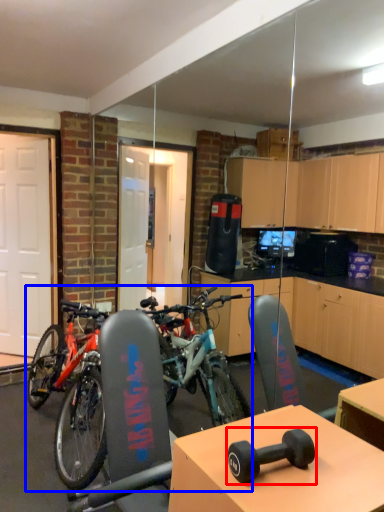
Question: Which of the following is the closest to the observer, dumbbell (highlighted by a red box) or bicycle (highlighted by a blue box)?

Choices:
 (A) dumbbell
 (B) bicycle

Answer: (A)